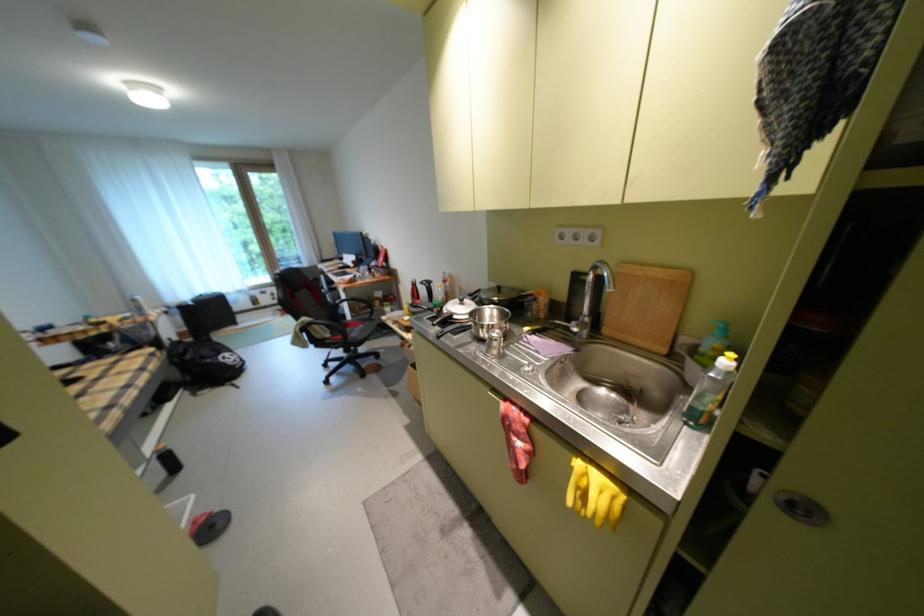
Locate an element on the screen. Image resolution: width=924 pixels, height=616 pixels. pump bottle dispenser is located at coordinates (712, 344).